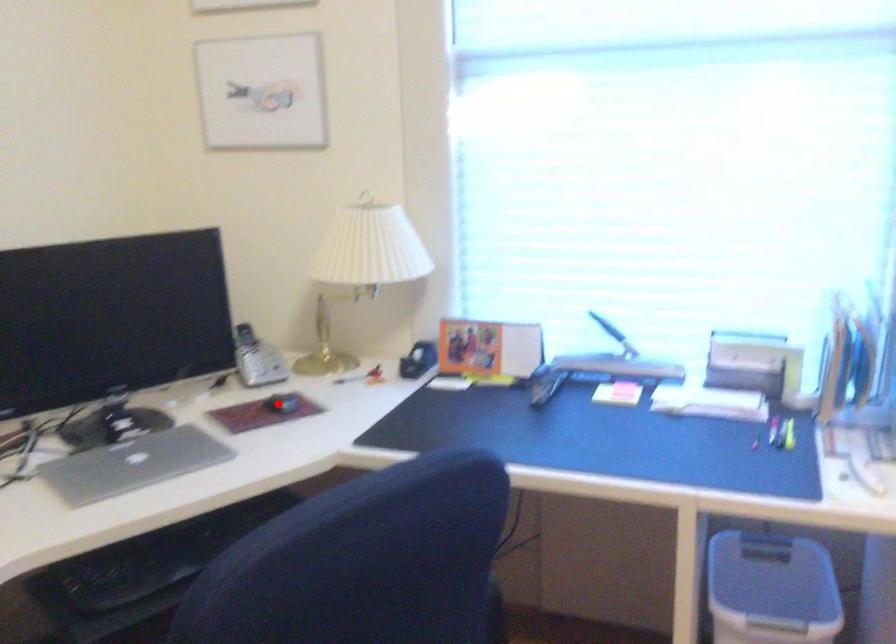
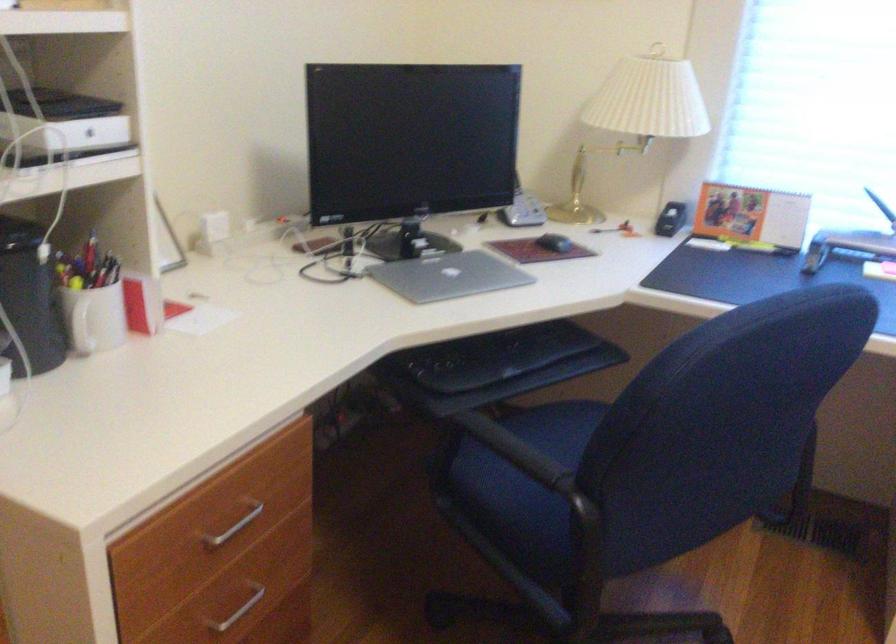
The point at the highlighted location is marked in the first image. Where is the corresponding point in the second image?

(554, 243)